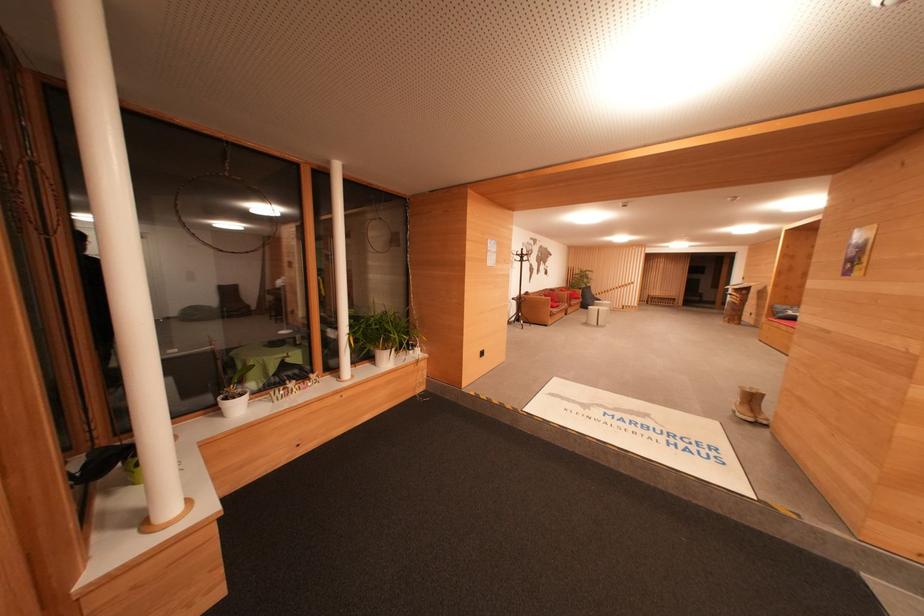
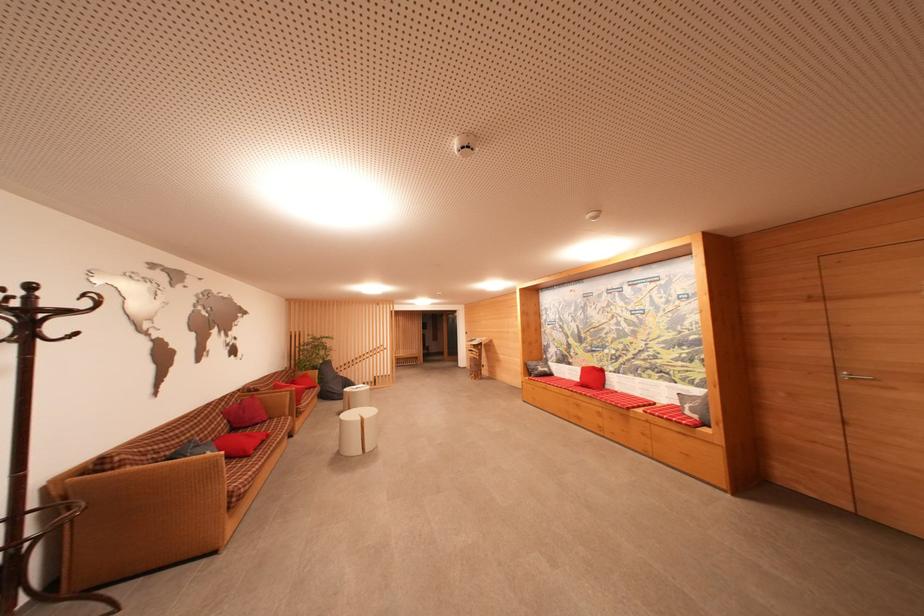
Find the pixel in the second image that matches point (795, 315) in the first image.

(544, 371)